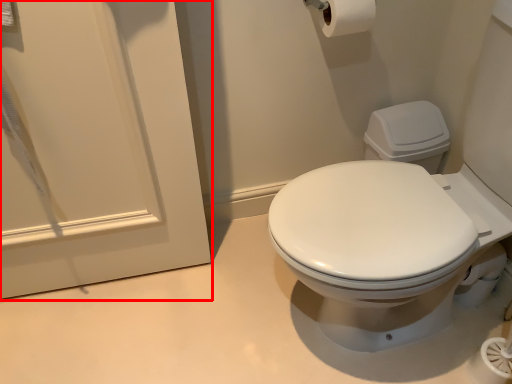
Question: From the image, what is the correct spatial relationship of screen door (annotated by the red box) in relation to toilet paper?

Choices:
 (A) right
 (B) left

Answer: (B)